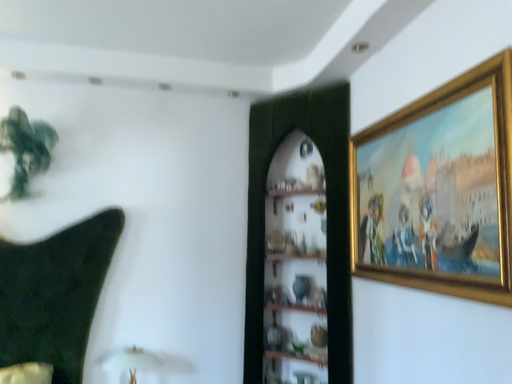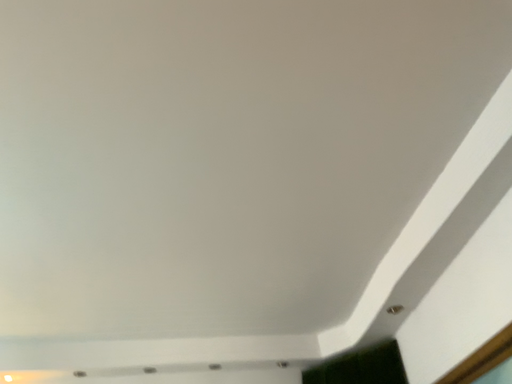
Question: How did the camera likely rotate when shooting the video?

Choices:
 (A) rotated left
 (B) rotated right

Answer: (A)